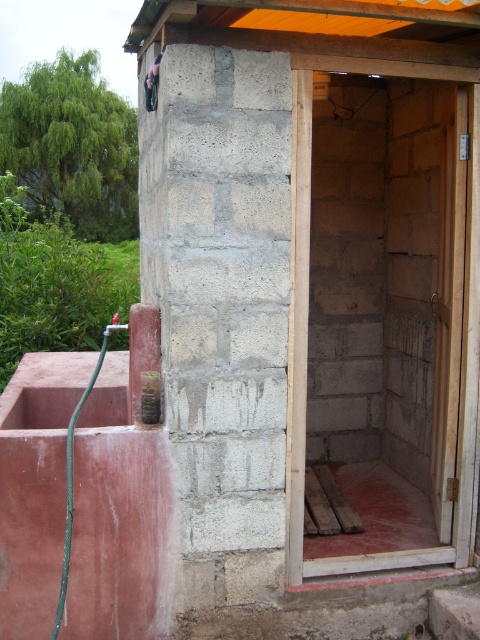
You need to place a small potted plant that is 10 cm wide between the gray concrete block at center and the green rubber hose at lower left. Can you fit it without overlapping either object?

The gray concrete block at center is bigger than the green rubber hose at lower left, but the exact distance between them isn